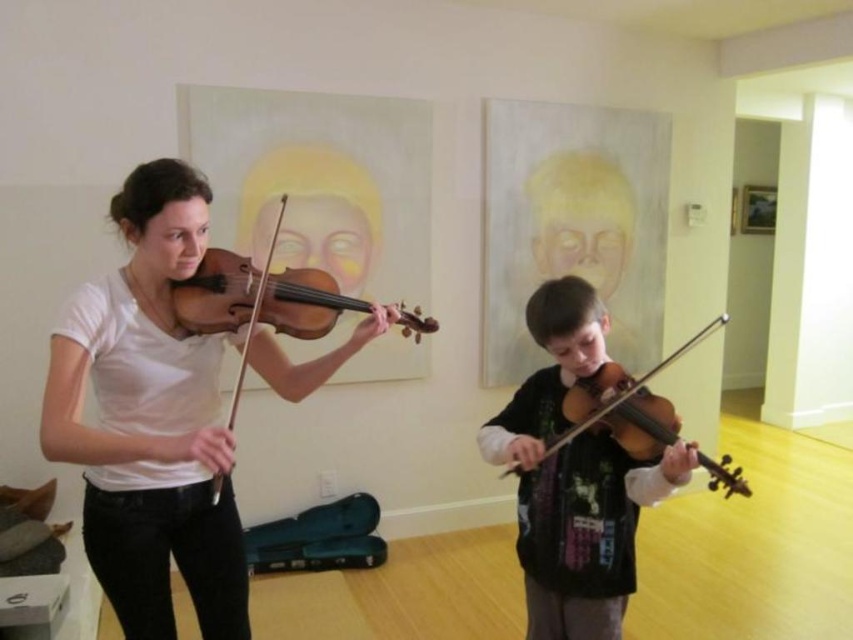
You are a music teacher observing two students practicing. You notice the matte white violin at left and the matte black violin at center. Which violin is located to the left of the other?

The matte white violin at left is positioned on the left side of the matte black violin at center.

You are a music teacher observing two students practicing with their violins. You notice the matte black violin at center and the wooden violin at lower center. Which one is bigger in size?

The matte black violin at center is larger in size compared to the wooden violin at lower center.